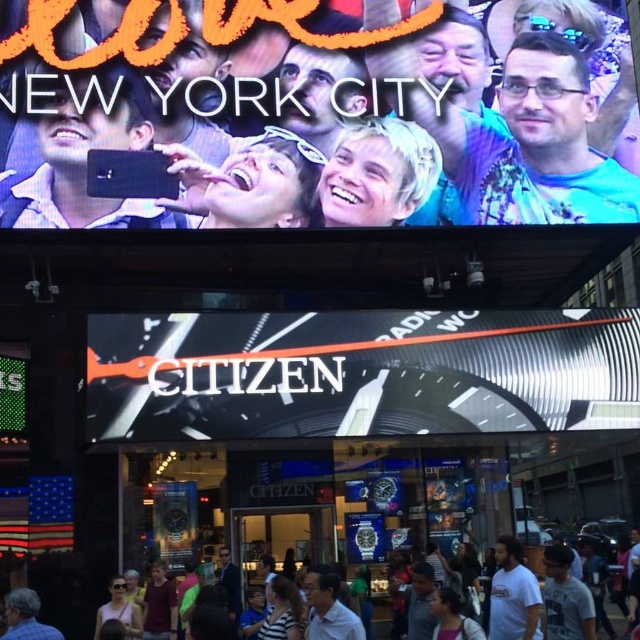
Is white cotton t-shirt at lower right further to the viewer compared to blue denim jeans at lower left?

Yes.

What do you see at coordinates (513, 595) in the screenshot?
I see `white cotton t-shirt at lower right` at bounding box center [513, 595].

Is point (509, 563) farther from camera compared to point (33, 618)?

Yes, it is.

Where is `white cotton t-shirt at lower right`? The width and height of the screenshot is (640, 640). white cotton t-shirt at lower right is located at coordinates (513, 595).

Can you confirm if matte black phone at upper center is positioned below white cotton t-shirt at lower right?

No.

What do you see at coordinates (321, 109) in the screenshot? This screenshot has width=640, height=640. I see `matte black phone at upper center` at bounding box center [321, 109].

At what (x,y) coordinates should I click in order to perform the action: click on matte black phone at upper center. Please return your answer as a coordinate pair (x, y). The width and height of the screenshot is (640, 640). Looking at the image, I should click on (321, 109).

Between gray cotton t-shirt at lower center and multicolored casual attire at lower center, which one has less height?

multicolored casual attire at lower center

Is point (582, 588) positioned in front of point (538, 570)?

Yes, it is.

Is point (554, 554) positioned behind point (528, 557)?

No, it is in front of (528, 557).

Where is `gray cotton t-shirt at lower center`? This screenshot has width=640, height=640. gray cotton t-shirt at lower center is located at coordinates (564, 598).